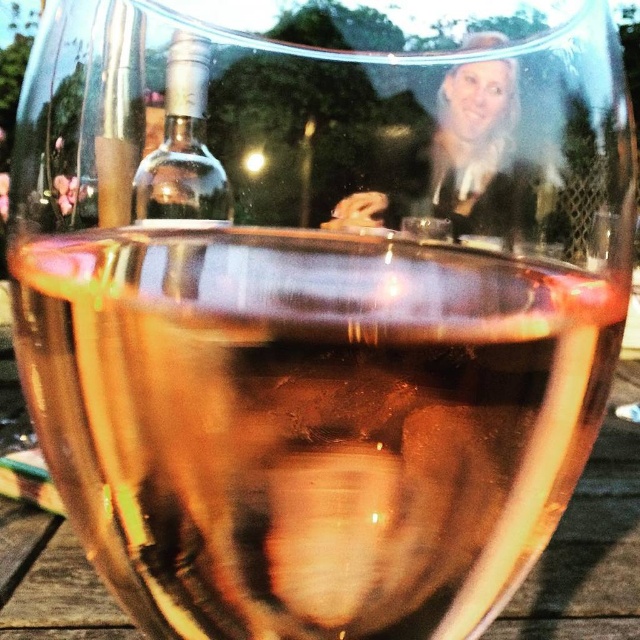
Question: Which of the following is the closest to the observer?

Choices:
 (A) (464, 186)
 (B) (164, 180)

Answer: (B)

Question: Does matte black hair at upper center have a smaller size compared to clear glass bottle at upper center?

Choices:
 (A) yes
 (B) no

Answer: (B)

Question: Among these points, which one is farthest from the camera?

Choices:
 (A) (513, 109)
 (B) (163, 218)

Answer: (A)

Question: Is matte black hair at upper center closer to camera compared to clear glass bottle at upper center?

Choices:
 (A) yes
 (B) no

Answer: (B)

Question: Is matte black hair at upper center above clear glass bottle at upper center?

Choices:
 (A) yes
 (B) no

Answer: (B)